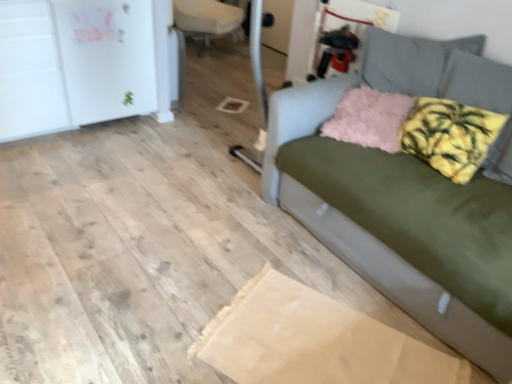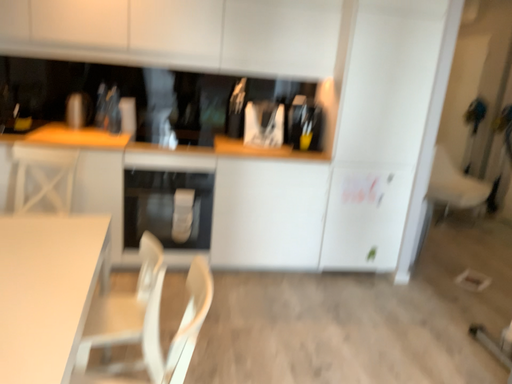
Question: Which way did the camera rotate in the video?

Choices:
 (A) rotated upward
 (B) rotated downward

Answer: (A)